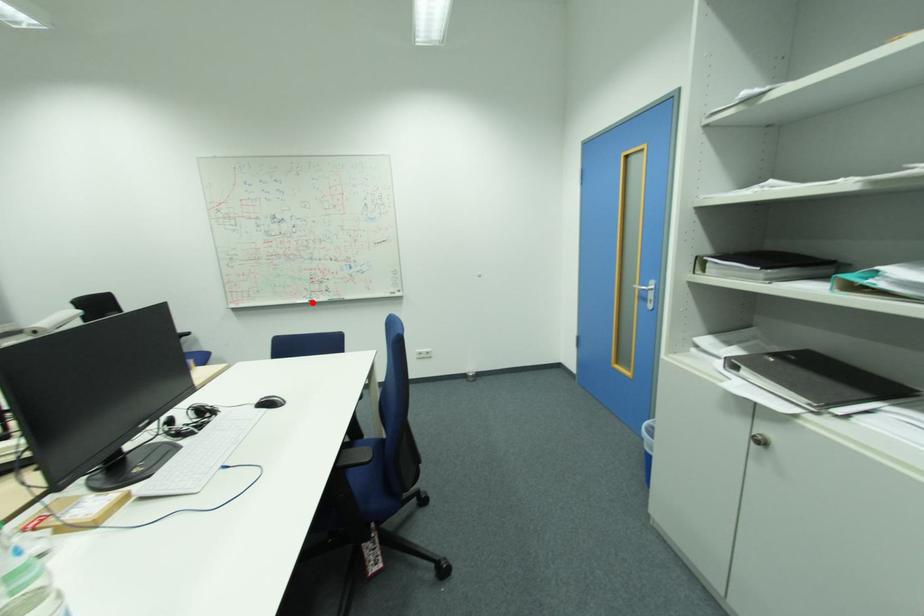
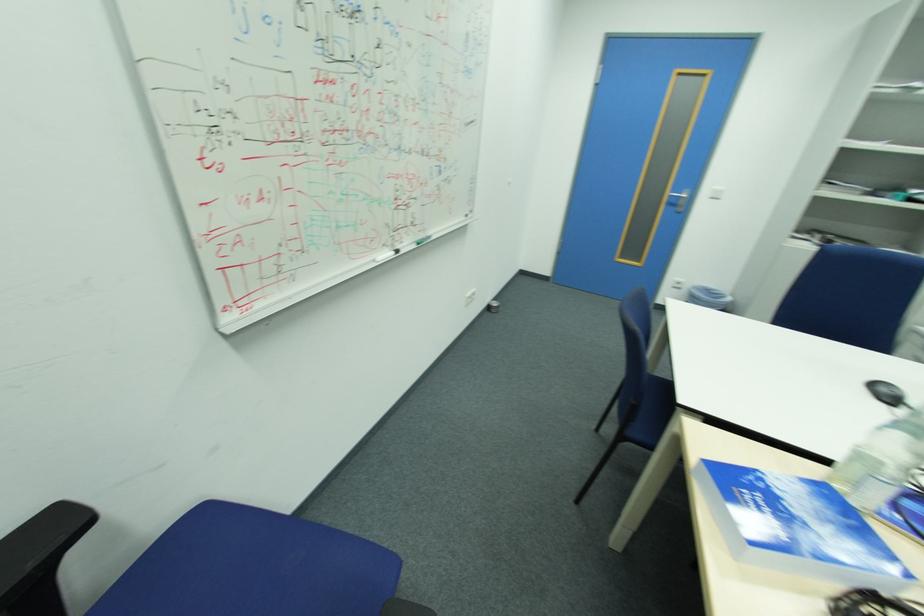
Locate, in the second image, the point that corresponds to the highlighted location in the first image.

(396, 256)